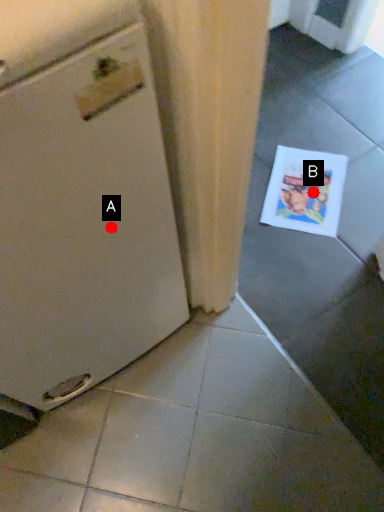
Question: Two points are circled on the image, labeled by A and B beside each circle. Which point is closer to the camera?

Choices:
 (A) A is closer
 (B) B is closer

Answer: (A)